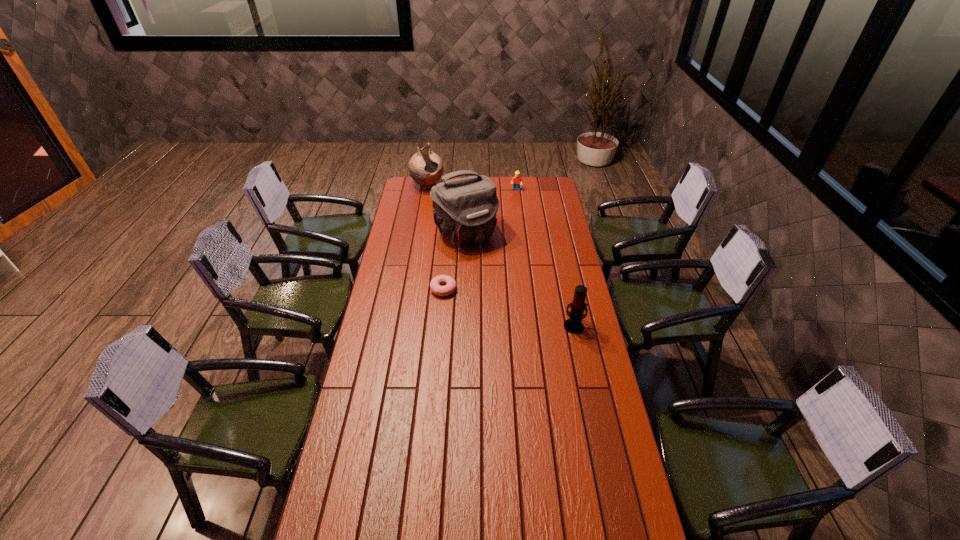
Locate an element on the screen. Image resolution: width=960 pixels, height=540 pixels. free location located 0.210m on the front of the third shortest object is located at coordinates (586, 377).

You are a GUI agent. You are given a task and a screenshot of the screen. Output one action in this format:
    pyautogui.click(x=<x>, y=<y>)
    Task: Click on the vacant area situated 0.210m on the open flap of the tallest object
    This screenshot has height=540, width=960.
    Given the screenshot: What is the action you would take?
    pyautogui.click(x=498, y=278)

The height and width of the screenshot is (540, 960). What are the coordinates of `vacant position located on the open flap of the tallest object` in the screenshot? It's located at (499, 279).

Where is `vacant space located 0.250m on the open flap of the tallest object`? The height and width of the screenshot is (540, 960). vacant space located 0.250m on the open flap of the tallest object is located at coordinates (503, 283).

This screenshot has height=540, width=960. What are the coordinates of `free region located on the face of the fourth tallest object` in the screenshot? It's located at (510, 220).

This screenshot has width=960, height=540. Find the location of `vacant space located 0.330m on the face of the fourth tallest object`. vacant space located 0.330m on the face of the fourth tallest object is located at coordinates (509, 224).

Find the location of `free space located 0.260m on the face of the fourth tallest object`. free space located 0.260m on the face of the fourth tallest object is located at coordinates (511, 217).

This screenshot has height=540, width=960. In order to click on free space located 0.140m from the spout of the pottery in this screenshot , I will do 443,206.

What are the coordinates of `vacant space located from the spout of the pottery` in the screenshot? It's located at (437, 198).

The image size is (960, 540). I want to click on vacant space situated 0.180m from the spout of the pottery, so click(445, 210).